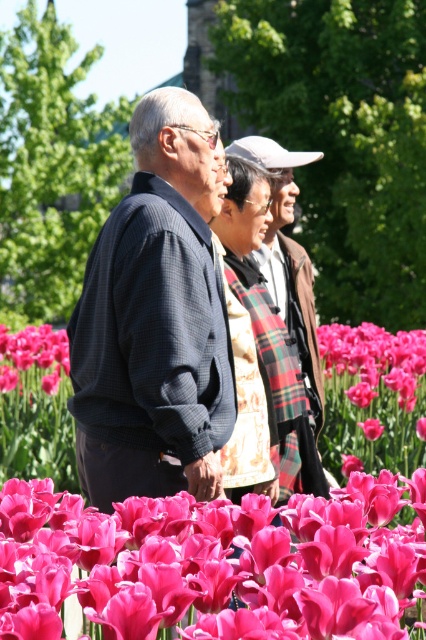
Question: Which point appears closest to the camera in this image?

Choices:
 (A) (212, 301)
 (B) (6, 340)
 (C) (302, 396)
 (D) (402, 332)

Answer: (A)

Question: Can you confirm if pink silky tulips at center is positioned to the left of pink matte tulip at lower center?

Choices:
 (A) yes
 (B) no

Answer: (A)

Question: Which of the following is the farthest from the observer?

Choices:
 (A) (94, 317)
 (B) (342, 538)

Answer: (A)

Question: Which of the following is the farthest from the observer?

Choices:
 (A) plaid fabric scarf at center
 (B) pink silky tulips at center

Answer: (A)

Question: In this image, where is plaid fabric scarf at center located relative to pink matte tulip at lower center?

Choices:
 (A) right
 (B) left

Answer: (B)

Question: Observing the image, what is the correct spatial positioning of pink silky tulips at center in reference to dark blue textured jacket at center?

Choices:
 (A) right
 (B) left

Answer: (A)